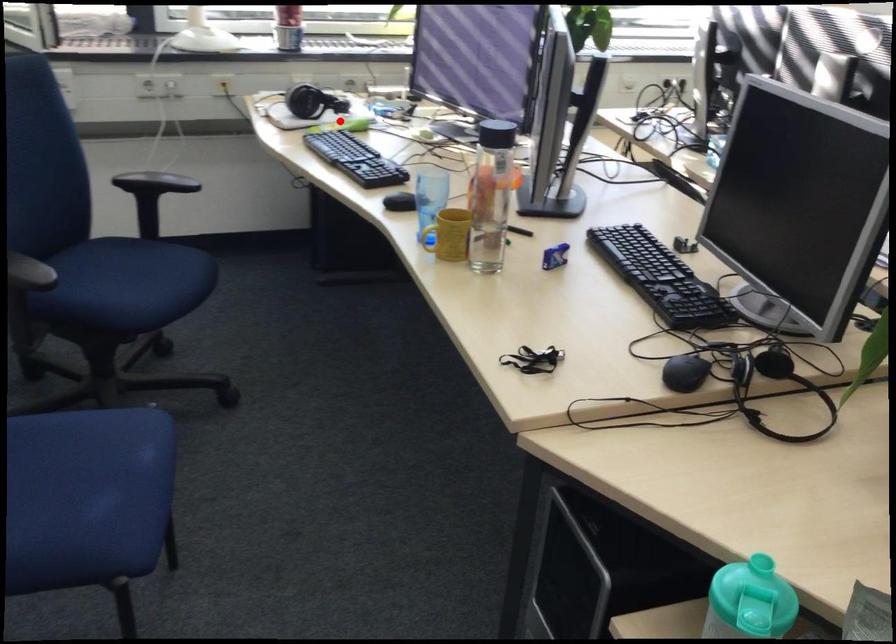
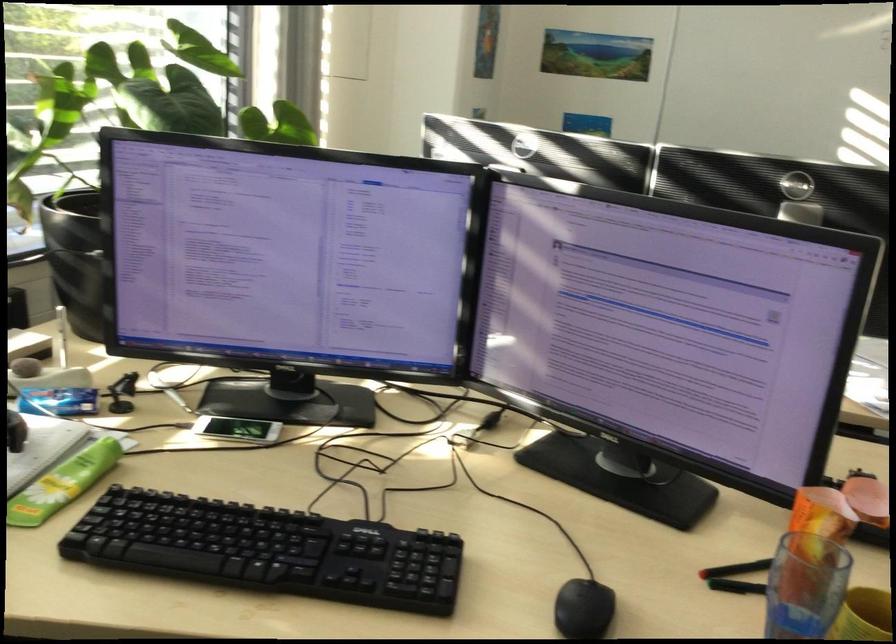
Find the pixel in the second image that matches the highlighted location in the first image.

(64, 483)